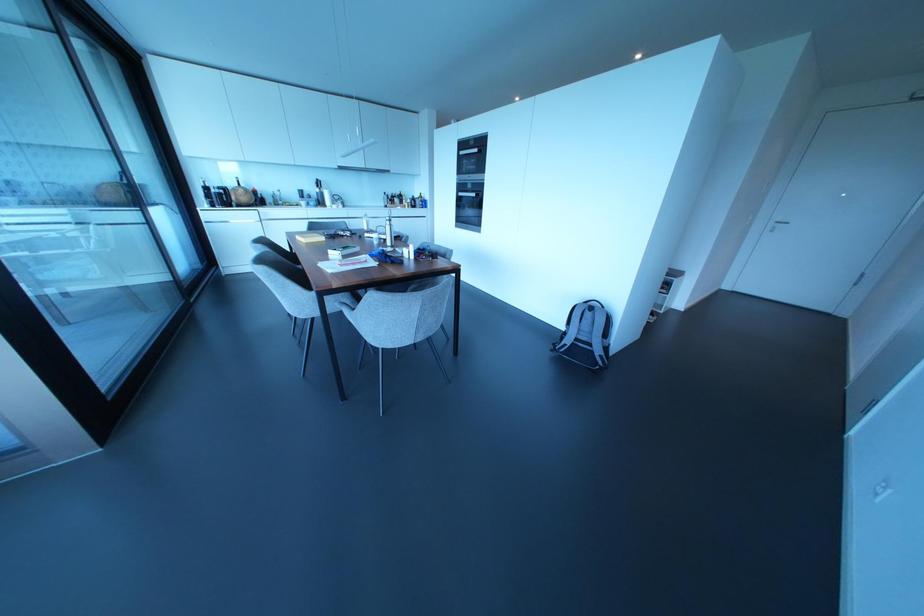
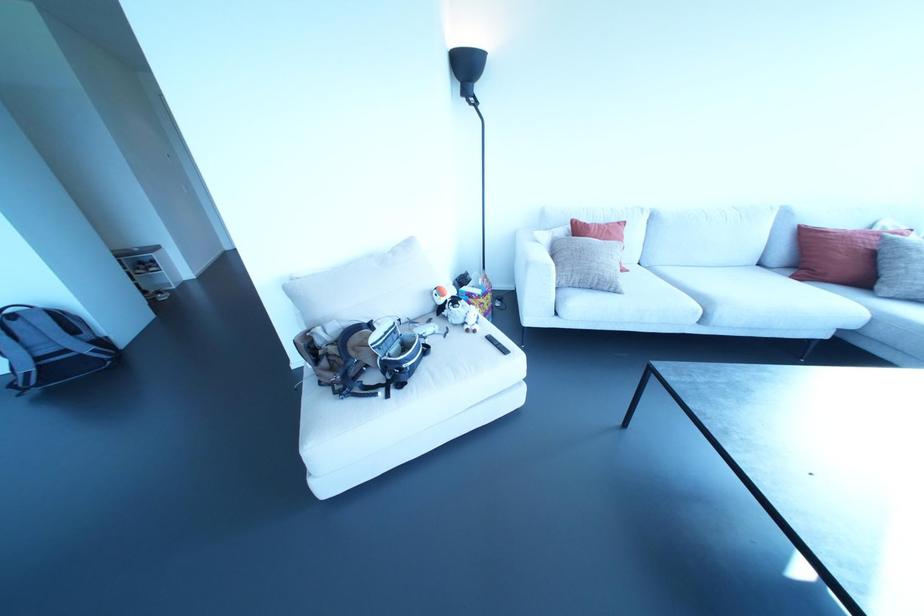
Where in the second image is the point corresponding to pixel 590 345 from the first image?

(65, 350)